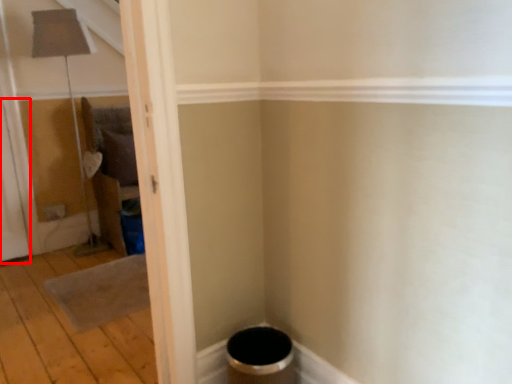
Question: From the image's perspective, considering the relative positions of screen door (annotated by the red box) and plywood in the image provided, where is screen door (annotated by the red box) located with respect to the staircase?

Choices:
 (A) below
 (B) above

Answer: (B)